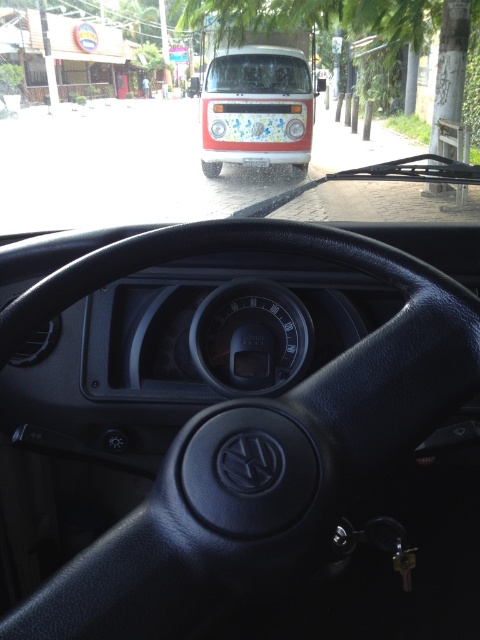
You are a passenger in the car and looking through the transparent glass windshield at center. You notice a white glossy bus at center outside. Which object is taller when viewed from your current position?

The white glossy bus at center is taller than the transparent glass windshield at center.

You are a passenger in the car and want to know the position of the white glossy bus at center relative to the black leather steering wheel at center. Which side of the steering wheel is the bus located?

The white glossy bus at center is to the right of the black leather steering wheel at center.

You are a passenger in the car and looking forward through the transparent glass windshield at center. Can you see the white glossy bus at center? Please explain why or why not based on their positions.

The white glossy bus at center is located below the transparent glass windshield at center, so yes, you can see the white glossy bus at center through the transparent glass windshield at center because it is positioned in front of the windshield.